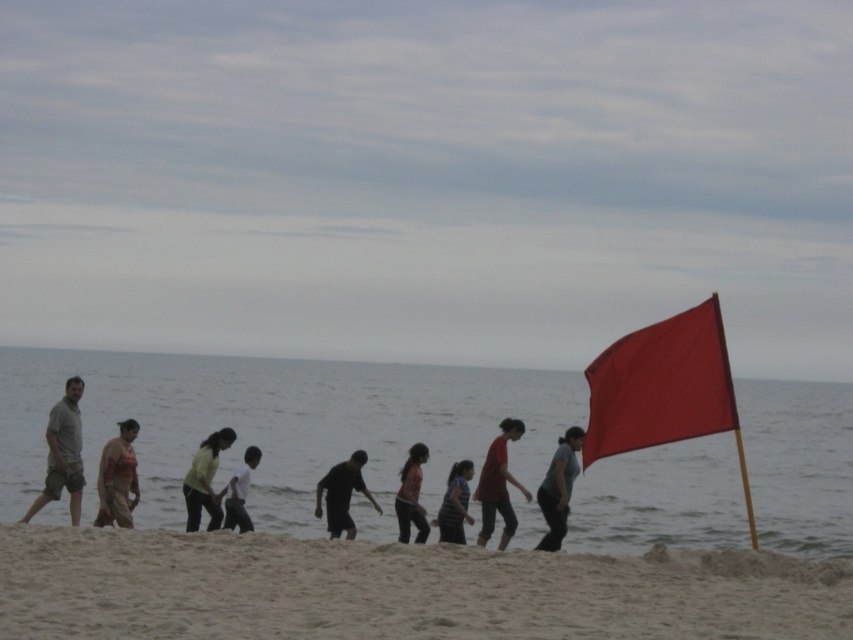
You are standing at point (x=421, y=529) and want to walk to the ocean. There is a flag at point (x=352, y=476). Will the flag block your path?

Point (x=352, y=476) is behind point (x=421, y=529), so the flag at point (x=352, y=476) will not block your path to the ocean.

You are a photographer trying to capture the smooth matte red flag at right and the matte khaki shorts at left in the same frame. Which object should you zoom in on to ensure both fit in the shot without cropping?

The smooth matte red flag at right has a lesser width compared to matte khaki shorts at left. To ensure both fit in the shot without cropping, you should zoom out slightly so that the wider matte khaki shorts at left fits, allowing the narrower smooth matte red flag at right to also be included.

In the scene shown: You are a photographer standing at the camera position. You want to take a photo of the smooth matte red flag at right. The camera has a maximum focus range of 15 meters. Will the flag be in focus?

The smooth matte red flag at right is 17.51 meters from the camera, which exceeds the camera maximum focus range of 15 meters. Therefore, the flag will not be in focus.